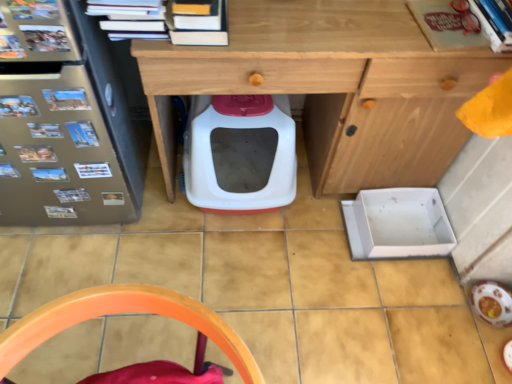
I want to click on free space above matte red book at upper right, which is the 2th book from right to left (from a real-world perspective), so click(x=449, y=22).